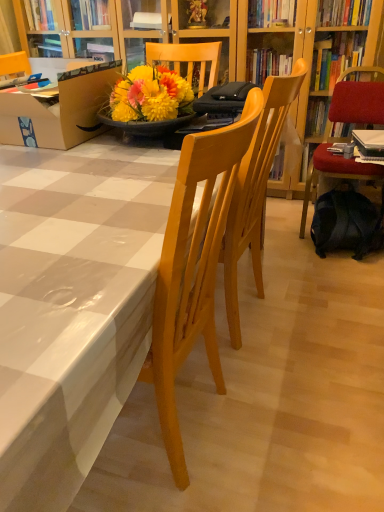
Question: Is black fabric backpack at lower right thinner than brown cardboard box at left?

Choices:
 (A) no
 (B) yes

Answer: (B)

Question: Can you confirm if black fabric backpack at lower right is positioned to the right of brown cardboard box at left?

Choices:
 (A) yes
 (B) no

Answer: (A)

Question: Is the surface of black fabric backpack at lower right in direct contact with brown cardboard box at left?

Choices:
 (A) yes
 (B) no

Answer: (B)

Question: Does black fabric backpack at lower right have a lesser height compared to brown cardboard box at left?

Choices:
 (A) yes
 (B) no

Answer: (A)

Question: Is black fabric backpack at lower right bigger than brown cardboard box at left?

Choices:
 (A) no
 (B) yes

Answer: (A)

Question: Is black fabric backpack at lower right situated inside brown cardboard box at left or outside?

Choices:
 (A) inside
 (B) outside

Answer: (B)

Question: Considering the relative positions of black fabric backpack at lower right and brown cardboard box at left in the image provided, is black fabric backpack at lower right to the left or to the right of brown cardboard box at left?

Choices:
 (A) right
 (B) left

Answer: (A)

Question: Is black fabric backpack at lower right in front of or behind brown cardboard box at left in the image?

Choices:
 (A) behind
 (B) front

Answer: (A)

Question: Is black fabric backpack at lower right taller or shorter than brown cardboard box at left?

Choices:
 (A) short
 (B) tall

Answer: (A)

Question: Looking at the image, does light wood chair at center, which is the first chair from front to back, seem bigger or smaller compared to black fabric backpack at lower right?

Choices:
 (A) big
 (B) small

Answer: (A)

Question: Is light wood chair at center, which appears as the first chair when viewed from the left, wider or thinner than black fabric backpack at lower right?

Choices:
 (A) thin
 (B) wide

Answer: (B)

Question: From a real-world perspective, relative to black fabric backpack at lower right, is light wood chair at center, which appears as the first chair when viewed from the left, vertically above or below?

Choices:
 (A) above
 (B) below

Answer: (A)

Question: Considering the relative positions of light wood chair at center, which appears as the first chair when viewed from the left, and black fabric backpack at lower right in the image provided, is light wood chair at center, which appears as the first chair when viewed from the left, to the left or to the right of black fabric backpack at lower right?

Choices:
 (A) left
 (B) right

Answer: (A)

Question: From the image's perspective, is white glossy table at center above or below black fabric backpack at lower right?

Choices:
 (A) above
 (B) below

Answer: (B)

Question: Relative to black fabric backpack at lower right, is white glossy table at center in front or behind?

Choices:
 (A) front
 (B) behind

Answer: (A)